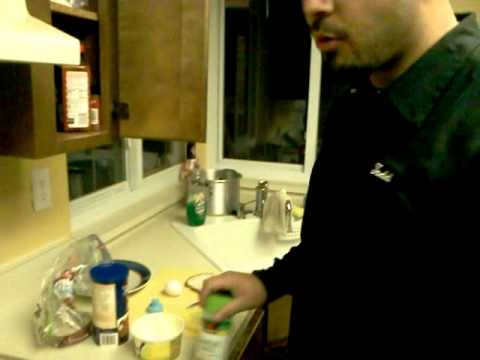
You are a GUI agent. You are given a task and a screenshot of the screen. Output one action in this format:
    pyautogui.click(x=<x>, y=<y>)
    Task: Click on the kitchen shelf
    
    Given the screenshot: What is the action you would take?
    pyautogui.click(x=158, y=253)